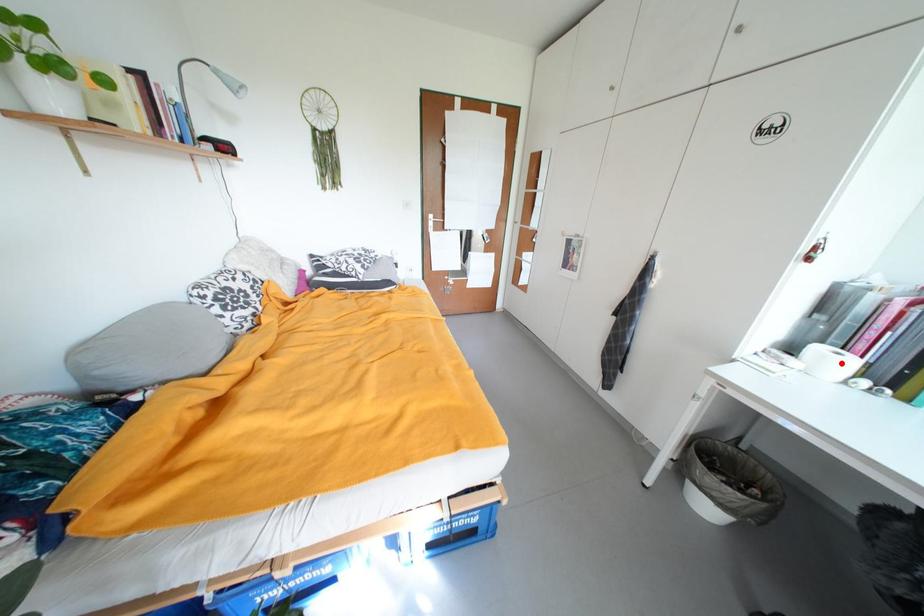
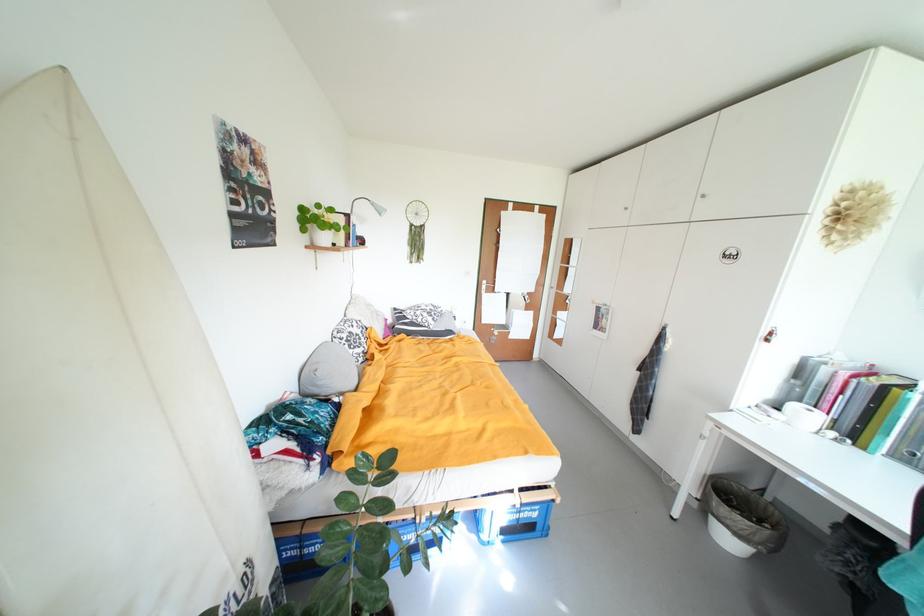
Question: I am providing you with two images of the same scene from different viewpoints. A red point is marked on the first image. Can you still see the location of the red point in image 2?

Choices:
 (A) Yes
 (B) No

Answer: (A)